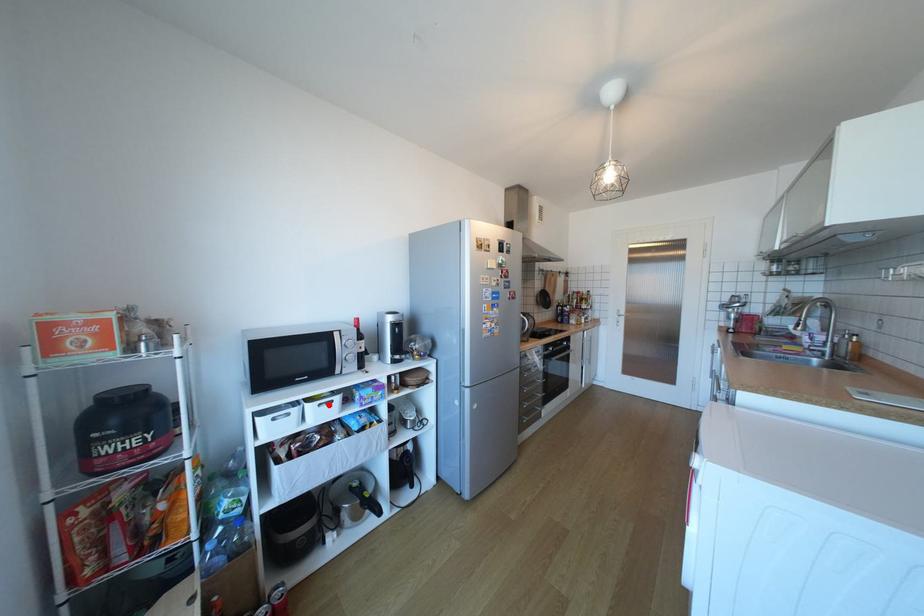
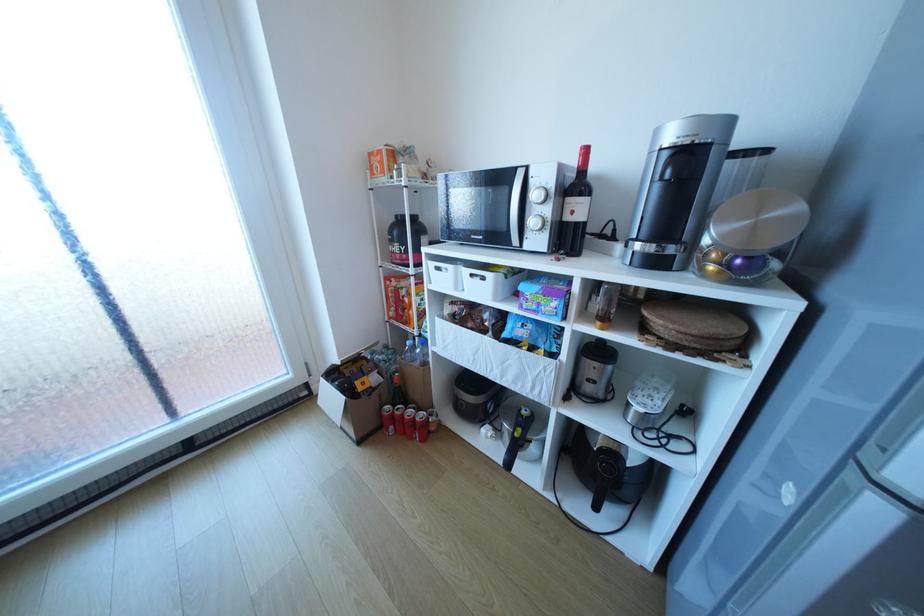
The point at the highlighted location is marked in the first image. Where is the corresponding point in the second image?

(481, 275)